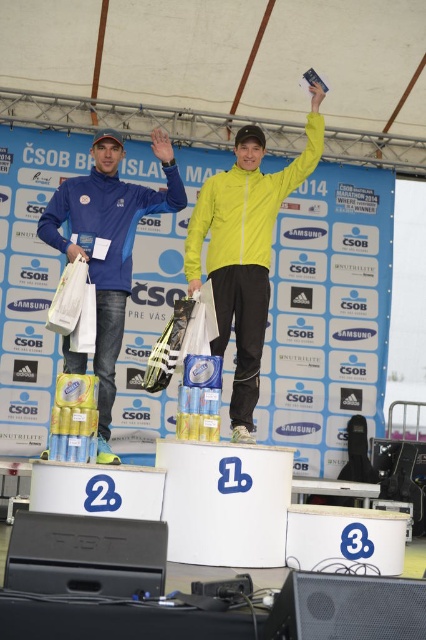
From the picture: You are a photographer at the marathon event and need to capture a photo of both the yellow matte jacket at center and the matte blue jacket at left in the same frame. The minimum distance between the two jackets required for your camera to focus on both is 60 centimeters. Will your camera be able to focus on both jackets?

The yellow matte jacket at center and the matte blue jacket at left are 63.55 centimeters apart from each other. Since this distance exceeds the 60 centimeter minimum requirement, the camera can focus on both jackets.

You are a photographer at the marathon event and want to take a photo of the two athletes wearing the matte blue jacket at left and the yellow matte jacket at center. From your current position, which athlete will appear closer in the photo?

The yellow matte jacket at center will appear closer in the photo because the matte blue jacket at left is positioned behind it.

From the picture: You are a photographer at the marathon event and want to take a photo of both the yellow matte jacket at center and the matte blue jacket at left. Based on their positions, which jacket should you focus on first to capture both in the frame?

The yellow matte jacket at center is to the right of the matte blue jacket at left. To capture both in the frame, you should focus on the matte blue jacket at left first since it is on the left side and then adjust to include the yellow matte jacket at center on the right.